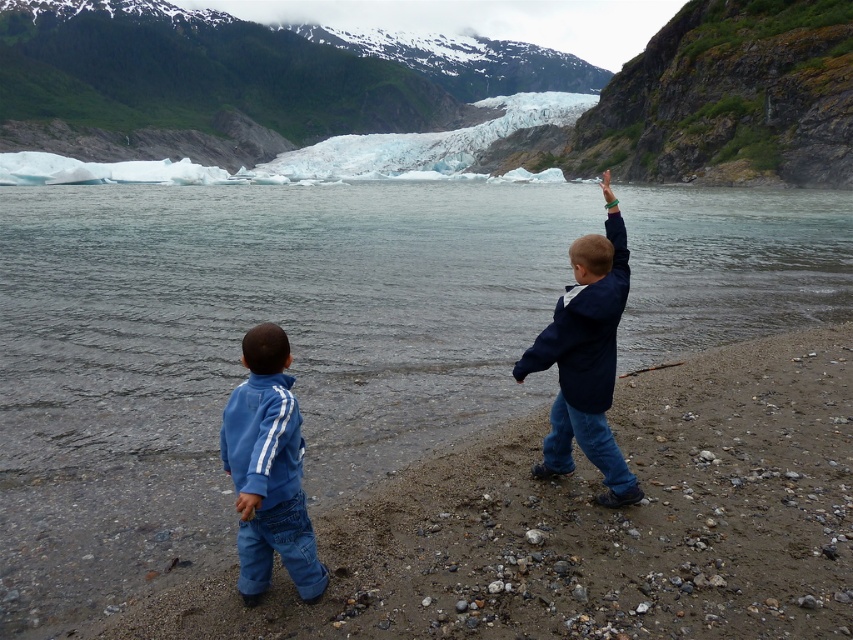
Which is more to the left, smooth sand beach at lower center or navy blue jacket at right?

smooth sand beach at lower center

Who is taller, smooth sand beach at lower center or navy blue jacket at right?

navy blue jacket at right

Identify the location of smooth sand beach at lower center. The height and width of the screenshot is (640, 853). (590, 524).

Identify the location of smooth sand beach at lower center. The width and height of the screenshot is (853, 640). (590, 524).

Is smooth sand beach at lower center to the right of blue fleece jacket at lower left from the viewer's perspective?

Correct, you'll find smooth sand beach at lower center to the right of blue fleece jacket at lower left.

The height and width of the screenshot is (640, 853). Identify the location of smooth sand beach at lower center. (590, 524).

Does point (238, 502) lie in front of point (537, 474)?

Yes.

Can you confirm if blue fleece jacket at lower left is bigger than navy blue jacket at right?

No, blue fleece jacket at lower left is not bigger than navy blue jacket at right.

Between point (291, 512) and point (531, 346), which one is positioned behind?

The point (531, 346) is more distant.

The height and width of the screenshot is (640, 853). I want to click on blue fleece jacket at lower left, so click(268, 470).